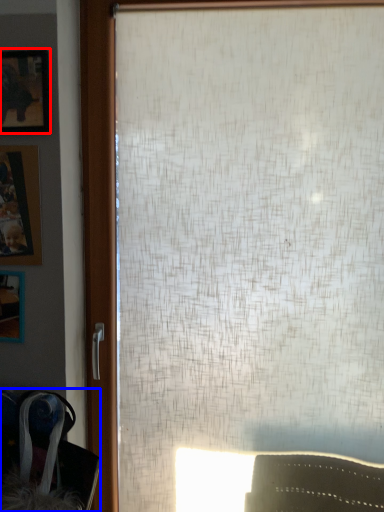
Question: Among these objects, which one is nearest to the camera, picture frame (highlighted by a red box) or swivel chair (highlighted by a blue box)?

Choices:
 (A) picture frame
 (B) swivel chair

Answer: (B)